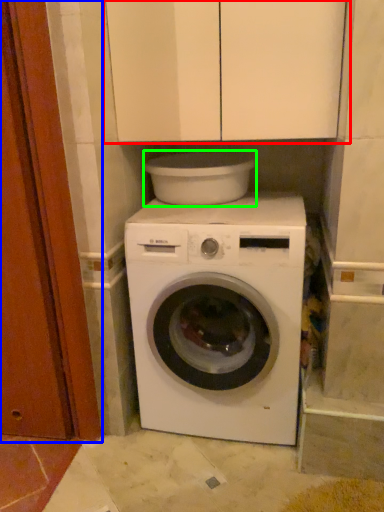
Question: Estimate the real-world distances between objects in this image. Which object is closer to cabinetry (highlighted by a red box), door (highlighted by a blue box) or appliance (highlighted by a green box)?

Choices:
 (A) door
 (B) appliance

Answer: (B)